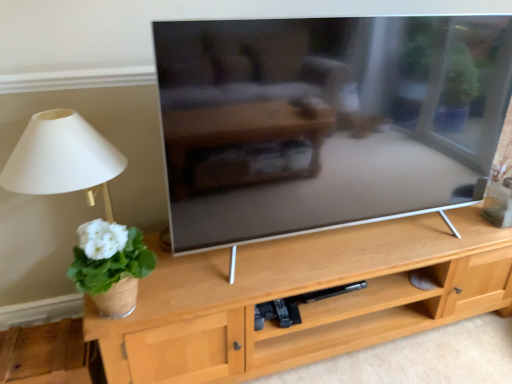
Question: From the image's perspective, is white matte plant at left beneath white fabric lampshade at left?

Choices:
 (A) yes
 (B) no

Answer: (A)

Question: Considering the relative sizes of white matte plant at left and white fabric lampshade at left in the image provided, is white matte plant at left thinner than white fabric lampshade at left?

Choices:
 (A) no
 (B) yes

Answer: (B)

Question: Is white matte plant at left facing towards white fabric lampshade at left?

Choices:
 (A) no
 (B) yes

Answer: (A)

Question: From a real-world perspective, is white matte plant at left over white fabric lampshade at left?

Choices:
 (A) no
 (B) yes

Answer: (A)

Question: Can you confirm if white matte plant at left is positioned to the right of white fabric lampshade at left?

Choices:
 (A) no
 (B) yes

Answer: (B)

Question: Is the surface of white matte plant at left in direct contact with white fabric lampshade at left?

Choices:
 (A) no
 (B) yes

Answer: (B)

Question: Is white fabric lampshade at left not inside white matte plant at left?

Choices:
 (A) yes
 (B) no

Answer: (A)

Question: Is white fabric lampshade at left to the left of white matte plant at left from the viewer's perspective?

Choices:
 (A) no
 (B) yes

Answer: (B)

Question: Does white fabric lampshade at left have a lesser width compared to white matte plant at left?

Choices:
 (A) yes
 (B) no

Answer: (B)

Question: Is white fabric lampshade at left aimed at white matte plant at left?

Choices:
 (A) yes
 (B) no

Answer: (A)

Question: From a real-world perspective, is white fabric lampshade at left physically below white matte plant at left?

Choices:
 (A) yes
 (B) no

Answer: (B)

Question: Can you confirm if white fabric lampshade at left is wider than white matte plant at left?

Choices:
 (A) yes
 (B) no

Answer: (A)

Question: From a real-world perspective, is white matte plant at left positioned above or below white fabric lampshade at left?

Choices:
 (A) above
 (B) below

Answer: (B)